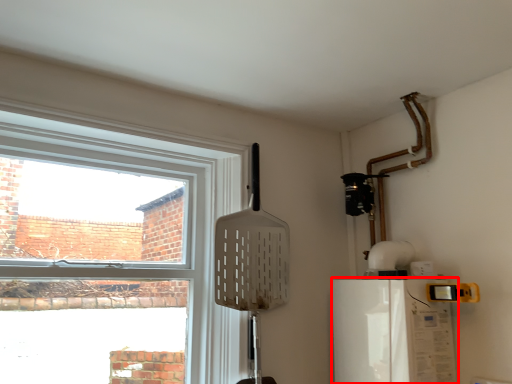
Question: From the image's perspective, where is appliance (annotated by the red box) located in relation to window in the image?

Choices:
 (A) above
 (B) below

Answer: (B)